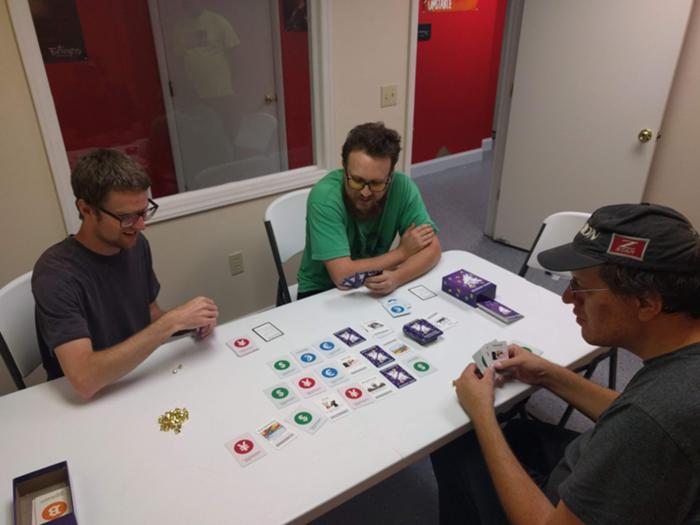
At what (x,y) coordinates should I click in order to perform the action: click on electrical outlet. Please return your answer as a coordinate pair (x, y). This screenshot has height=525, width=700. Looking at the image, I should click on (237, 270).